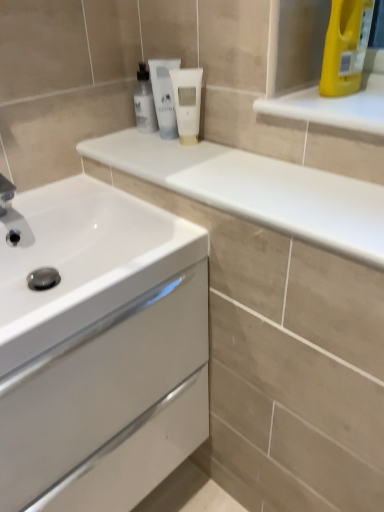
This screenshot has width=384, height=512. In order to click on vacant space situated on the left part of white matte tube at center, acting as the 2th mouthwash starting from the left in this screenshot , I will do `click(122, 141)`.